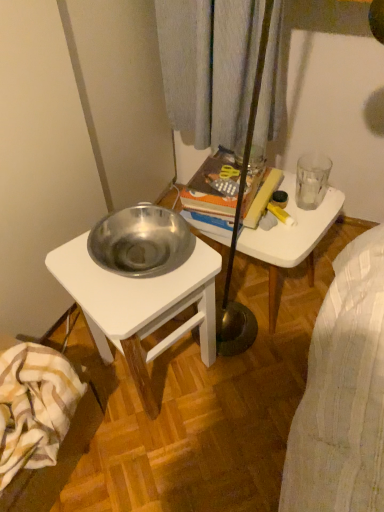
Where is `white glossy table at upper center`? This screenshot has width=384, height=512. white glossy table at upper center is located at coordinates (291, 238).

Describe the element at coordinates (34, 407) in the screenshot. I see `striped cotton blanket at lower left` at that location.

What do you see at coordinates (140, 306) in the screenshot?
I see `polished silver bowl at left` at bounding box center [140, 306].

Measure the distance between point (245, 197) and camera.

Point (245, 197) and camera are 1.10 meters apart from each other.

You are a GUI agent. You are given a task and a screenshot of the screen. Output one action in this format:
    pyautogui.click(x=<x>, y=<y>)
    Task: Click on the white glossy table at upper center
    This screenshot has height=512, width=384.
    Given the screenshot: What is the action you would take?
    pyautogui.click(x=291, y=238)

Considering the sizes of objects orange hardcover book at center and striped cotton blanket at lower left in the image provided, who is bigger, orange hardcover book at center or striped cotton blanket at lower left?

striped cotton blanket at lower left.

Considering the positions of point (200, 206) and point (6, 400), is point (200, 206) closer or farther from the camera than point (6, 400)?

Point (200, 206) is farther from the camera than point (6, 400).

Which object is further away from the camera taking this photo, orange hardcover book at center or striped cotton blanket at lower left?

Positioned behind is orange hardcover book at center.

What's the angular difference between orange hardcover book at center and striped cotton blanket at lower left's facing directions?

99.8 degrees separate the facing orientations of orange hardcover book at center and striped cotton blanket at lower left.

Is white glossy table at upper center aimed at orange hardcover book at center?

No.

Is the surface of white glossy table at upper center in direct contact with orange hardcover book at center?

white glossy table at upper center and orange hardcover book at center are clearly separated.

Which object is further away from the camera taking this photo, white glossy table at upper center or orange hardcover book at center?

white glossy table at upper center is behind.

Considering the positions of points (267, 234) and (216, 152), is point (267, 234) closer to camera compared to point (216, 152)?

Yes, it is.

Which object is positioned more to the right, orange hardcover book at center or white glossy table at upper center?

white glossy table at upper center is more to the right.

Which is in front, point (276, 176) or point (219, 241)?

Point (219, 241)

Identify the location of book positioned vertically above the white glossy table at upper center (from a real-world perspective). (213, 194).

Is striped cotton blanket at lower left not close to white glossy table at upper center?

No, there isn't a large distance between striped cotton blanket at lower left and white glossy table at upper center.

Considering the sizes of striped cotton blanket at lower left and white glossy table at upper center in the image, is striped cotton blanket at lower left wider or thinner than white glossy table at upper center?

In the image, striped cotton blanket at lower left appears to be more narrow than white glossy table at upper center.

Is striped cotton blanket at lower left aimed at white glossy table at upper center?

No.

Which is less distant, (38, 435) or (275, 296)?

The point (38, 435) is in front.

What's the angular difference between white glossy table at upper center and transparent glass at upper right's facing directions?

The angle between the facing direction of white glossy table at upper center and the facing direction of transparent glass at upper right is 76 degrees.

Is there a large distance between white glossy table at upper center and transparent glass at upper right?

Actually, white glossy table at upper center and transparent glass at upper right are a little close together.

Which is in front, white glossy table at upper center or transparent glass at upper right?

white glossy table at upper center.

Considering the sizes of objects transparent glass at upper right and orange hardcover book at center in the image provided, who is thinner, transparent glass at upper right or orange hardcover book at center?

Thinner between the two is transparent glass at upper right.

At what (x,y) coordinates should I click in order to perform the action: click on coffee cup lying behind the orange hardcover book at center. Please return your answer as a coordinate pair (x, y). This screenshot has height=512, width=384. Looking at the image, I should click on (312, 180).

Can you confirm if transparent glass at upper right is taller than orange hardcover book at center?

No.

Can you confirm if transparent glass at upper right is bigger than orange hardcover book at center?

No.

Which is behind, point (143, 405) or point (322, 191)?

The point (322, 191) is more distant.

Is polished silver bowl at left far away from transparent glass at upper right?

polished silver bowl at left is actually quite close to transparent glass at upper right.

Is polished silver bowl at left bigger or smaller than transparent glass at upper right?

In the image, polished silver bowl at left appears to be larger than transparent glass at upper right.

In the image, there is a orange hardcover book at center. At what (x,y) coordinates should I click in order to perform the action: click on blanket below it (from a real-world perspective). Please return your answer as a coordinate pair (x, y). This screenshot has height=512, width=384. Looking at the image, I should click on (34, 407).

You are a GUI agent. You are given a task and a screenshot of the screen. Output one action in this format:
    pyautogui.click(x=<x>, y=<y>)
    Task: Click on the table to the right of orange hardcover book at center
    
    Given the screenshot: What is the action you would take?
    pyautogui.click(x=291, y=238)

Estimate the real-world distances between objects in this image. Which object is further from transparent glass at upper right, striped cotton blanket at lower left or orange hardcover book at center?

The object further to transparent glass at upper right is striped cotton blanket at lower left.

When comparing their distances from transparent glass at upper right, does polished silver bowl at left or white glossy table at upper center seem further?

polished silver bowl at left.

Estimate the real-world distances between objects in this image. Which object is further from orange hardcover book at center, polished silver bowl at left or striped cotton blanket at lower left?

striped cotton blanket at lower left is further to orange hardcover book at center.

Estimate the real-world distances between objects in this image. Which object is further from orange hardcover book at center, polished silver bowl at left or white glossy table at upper center?

polished silver bowl at left.

Estimate the real-world distances between objects in this image. Which object is closer to orange hardcover book at center, transparent glass at upper right or polished silver bowl at left?

transparent glass at upper right lies closer to orange hardcover book at center than the other object.

Estimate the real-world distances between objects in this image. Which object is further from white glossy table at upper center, polished silver bowl at left or striped cotton blanket at lower left?

Based on the image, striped cotton blanket at lower left appears to be further to white glossy table at upper center.

Based on their spatial positions, is transparent glass at upper right or white glossy table at upper center further from orange hardcover book at center?

transparent glass at upper right is positioned further to the anchor orange hardcover book at center.

Looking at this image, when comparing their distances from polished silver bowl at left, does striped cotton blanket at lower left or white glossy table at upper center seem further?

Based on the image, white glossy table at upper center appears to be further to polished silver bowl at left.

This screenshot has width=384, height=512. Find the location of `table between striped cotton blanket at lower left and transparent glass at upper right from left to right`. table between striped cotton blanket at lower left and transparent glass at upper right from left to right is located at coordinates (291, 238).

Locate an element on the screen. The width and height of the screenshot is (384, 512). book situated between striped cotton blanket at lower left and transparent glass at upper right from left to right is located at coordinates (213, 194).

Identify the location of book between polished silver bowl at left and white glossy table at upper center. The width and height of the screenshot is (384, 512). (213, 194).

You are a GUI agent. You are given a task and a screenshot of the screen. Output one action in this format:
    pyautogui.click(x=<x>, y=<y>)
    Task: Click on the desk between orange hardcover book at center and striped cotton blanket at lower left in the up-down direction
    This screenshot has width=384, height=512.
    Given the screenshot: What is the action you would take?
    pyautogui.click(x=140, y=306)